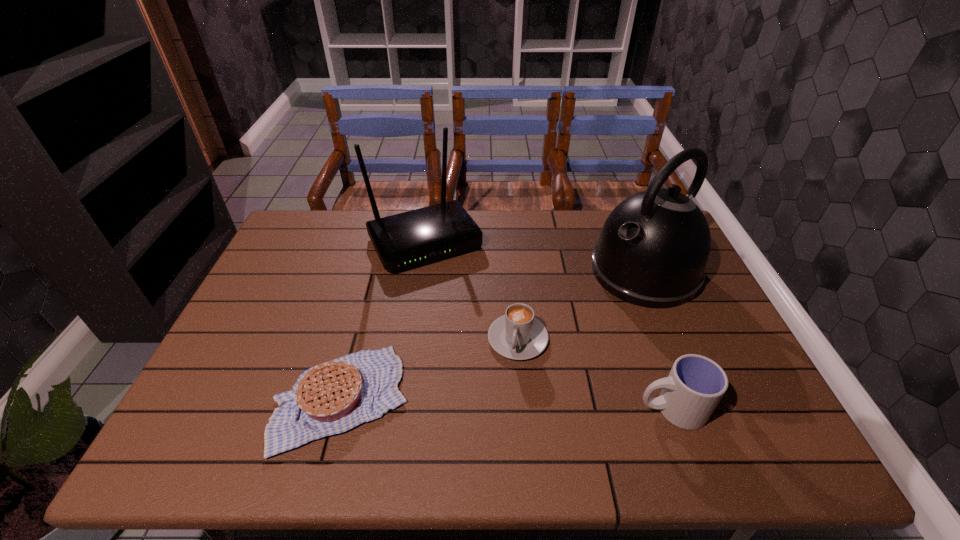
You are a GUI agent. You are given a task and a screenshot of the screen. Output one action in this format:
    pyautogui.click(x=<x>, y=<y>)
    Task: Click on the pie
    This screenshot has height=540, width=960.
    Given the screenshot: What is the action you would take?
    pyautogui.click(x=333, y=397)

Where is `cup`? The width and height of the screenshot is (960, 540). cup is located at coordinates (695, 385).

Image resolution: width=960 pixels, height=540 pixels. Identify the location of the fourth tallest object. (517, 335).

At what (x,y) coordinates should I click in order to perform the action: click on the third object from right to left. Please return your answer as a coordinate pair (x, y). Image resolution: width=960 pixels, height=540 pixels. Looking at the image, I should click on (517, 335).

Identify the location of router. This screenshot has height=540, width=960. (411, 238).

The height and width of the screenshot is (540, 960). In order to click on the tallest object in this screenshot , I will do `click(652, 252)`.

Identify the location of free location located 0.320m on the right of the pie. (545, 399).

Image resolution: width=960 pixels, height=540 pixels. Find the location of `vacant area situated 0.380m with the handle on the side of the cup`. vacant area situated 0.380m with the handle on the side of the cup is located at coordinates (471, 409).

Locate an element on the screen. The width and height of the screenshot is (960, 540). free region located 0.250m with the handle on the side of the cup is located at coordinates (528, 409).

Find the location of a particular element. The width and height of the screenshot is (960, 540). free location located 0.310m with the handle on the side of the cup is located at coordinates (502, 409).